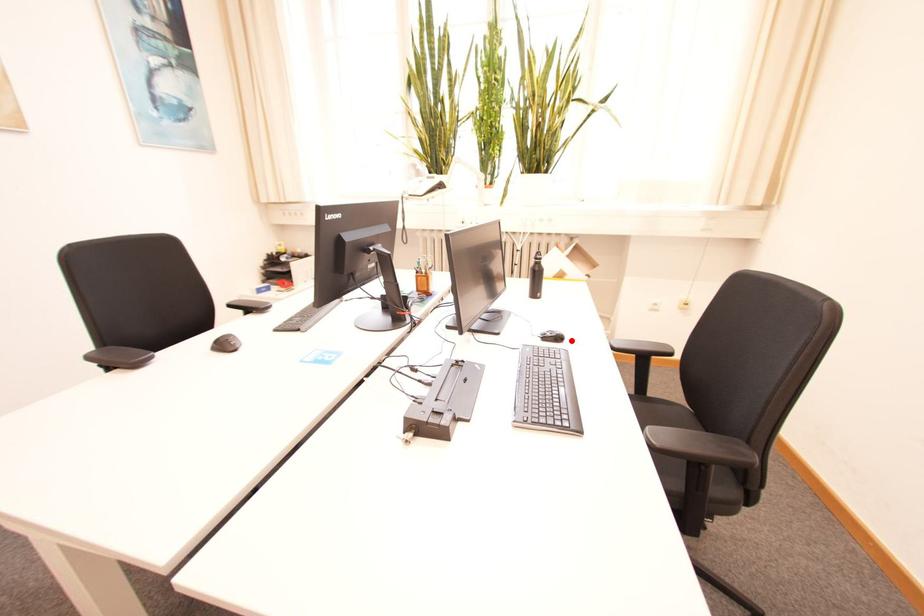
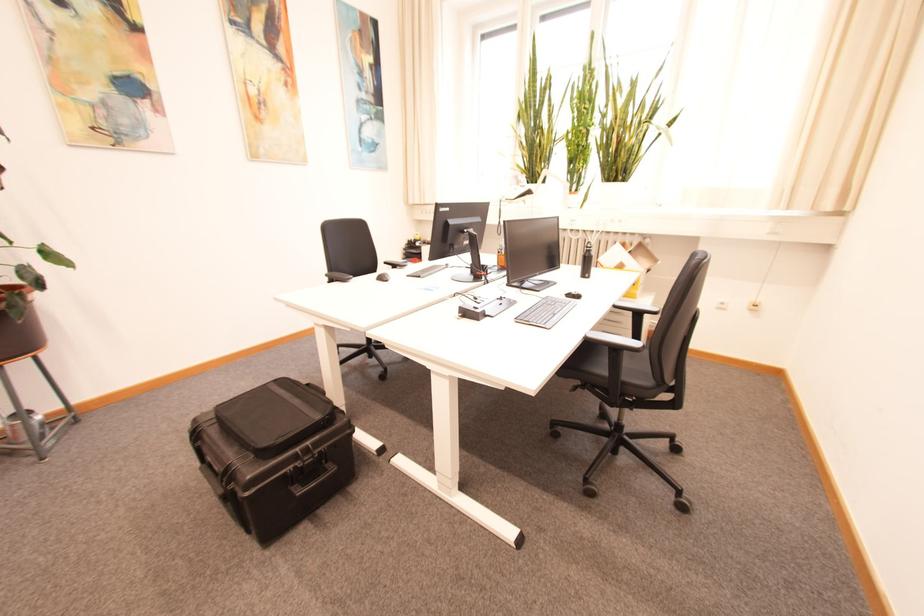
Where in the second image is the point corresponding to the highlighted location from the first image?

(589, 299)